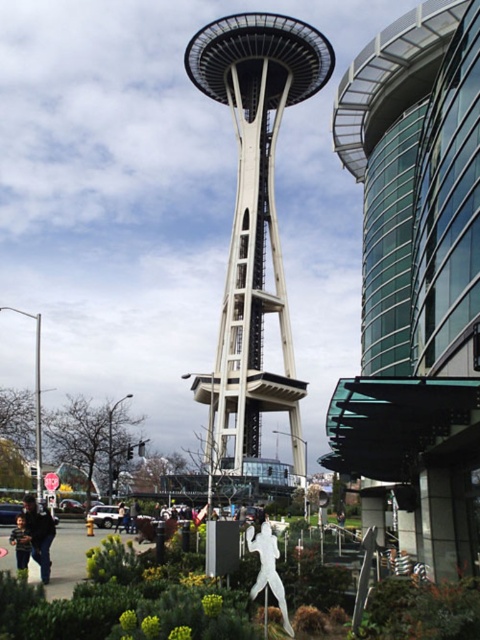
You are standing at the base of the Space Needle and see the matte black jacket at lower left. If you want to walk directly towards the jacket, which direction should you move relative to the Space Needle?

To walk directly towards the matte black jacket at lower left, you should move towards the lower left direction from the Space Needle.

You are a delivery drone with a wingspan of 3 meters. You need to fly from the transparent glass building at upper right to the matte black jacket at lower left. Is there enough space between them for your drone to pass through?

The distance between the transparent glass building at upper right and the matte black jacket at lower left is 128.56 feet, which converts to approximately 39.18 meters. Since your drone has a wingspan of 3 meters, there is ample space for it to pass through safely.